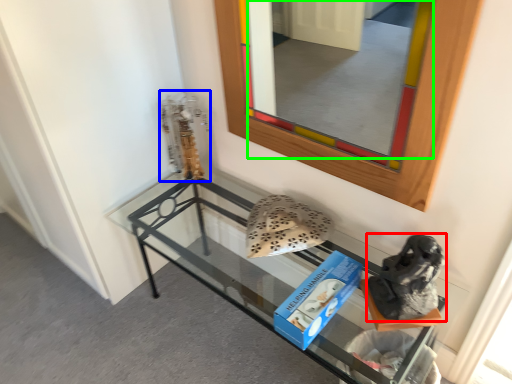
Question: Which object is positioned farthest from footwear (highlighted by a red box)? Select from sculpture (highlighted by a blue box) and mirror (highlighted by a green box).

Choices:
 (A) sculpture
 (B) mirror

Answer: (B)